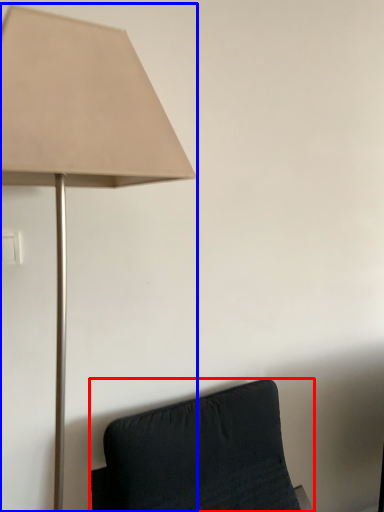
Question: Which point is closer to the camera, furniture (highlighted by a red box) or lamp (highlighted by a blue box)?

Choices:
 (A) furniture
 (B) lamp

Answer: (B)